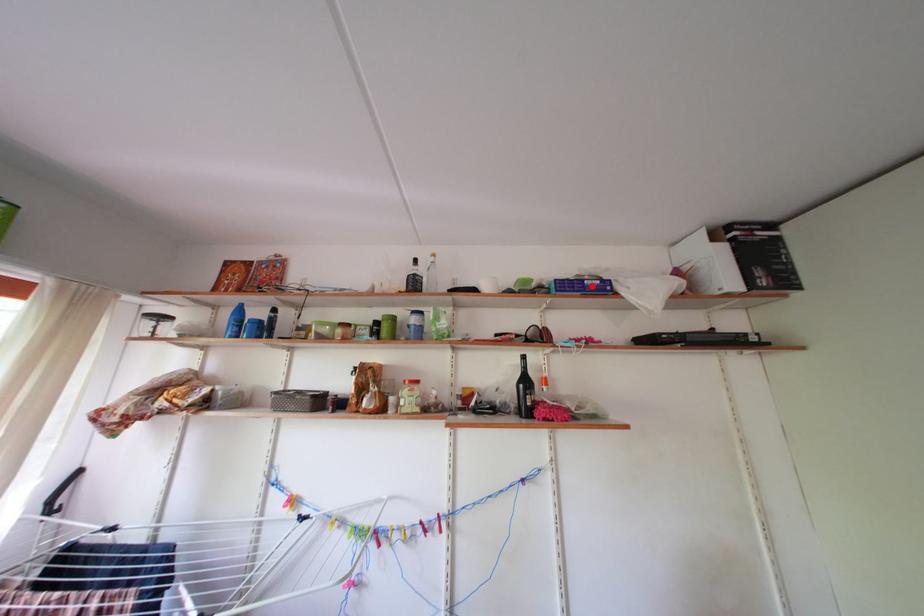
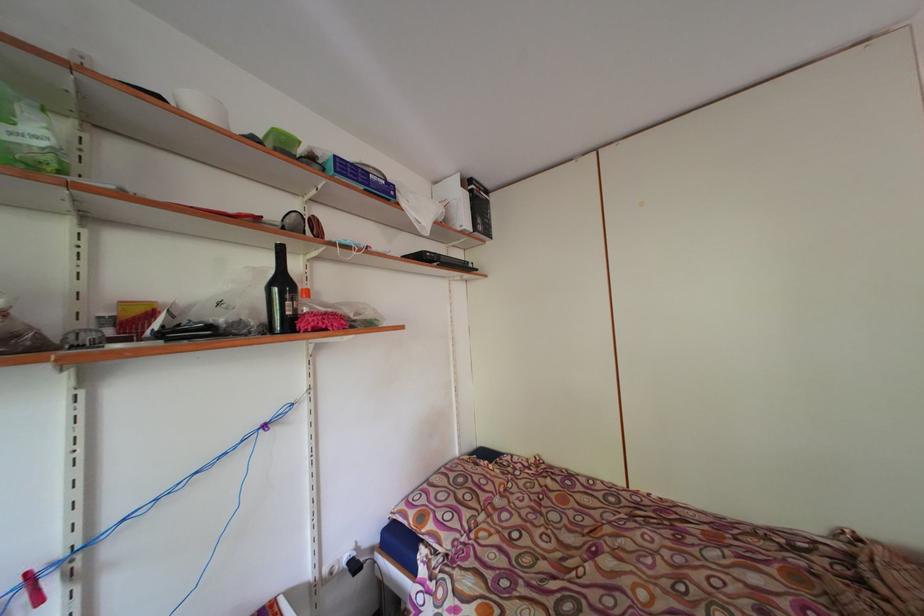
Locate, in the second image, the point that corresponds to the highlighted location in the first image.

(377, 180)